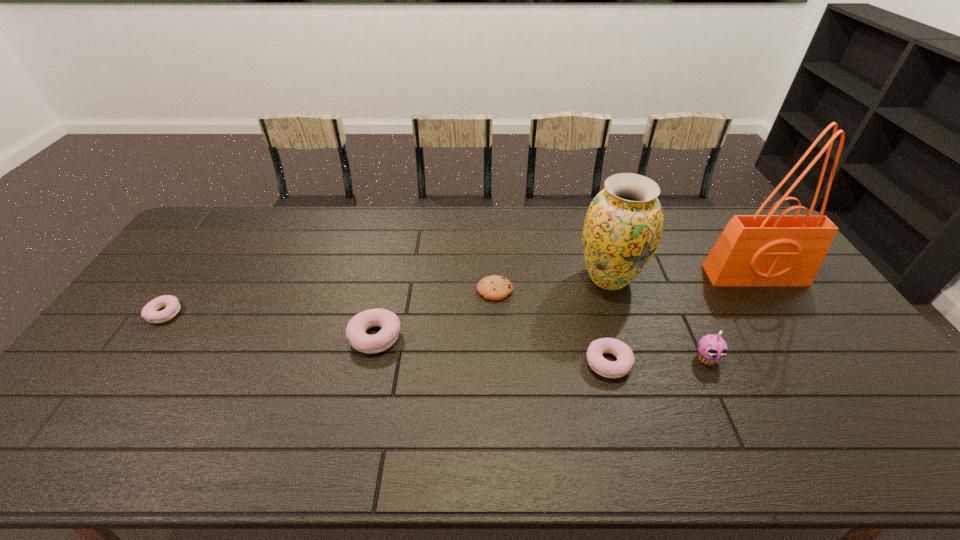
The height and width of the screenshot is (540, 960). Find the location of `the leftmost object`. the leftmost object is located at coordinates (151, 313).

This screenshot has height=540, width=960. I want to click on the shortest doughnut, so click(151, 313).

This screenshot has height=540, width=960. Find the location of `the tallest doughnut`. the tallest doughnut is located at coordinates [356, 328].

Where is `the second doughnut from right to left`? This screenshot has height=540, width=960. the second doughnut from right to left is located at coordinates tap(356, 328).

Find the location of `the fifth tallest object`. the fifth tallest object is located at coordinates (625, 359).

Identify the location of the rightmost doughnut. (625, 359).

Where is `vase`? This screenshot has width=960, height=540. vase is located at coordinates (622, 229).

The width and height of the screenshot is (960, 540). Find the location of `the third object from left to right`. the third object from left to right is located at coordinates (495, 288).

The width and height of the screenshot is (960, 540). What are the coordinates of `the shortest object` in the screenshot? It's located at (495, 288).

This screenshot has height=540, width=960. Identify the location of the third tallest object. (711, 348).